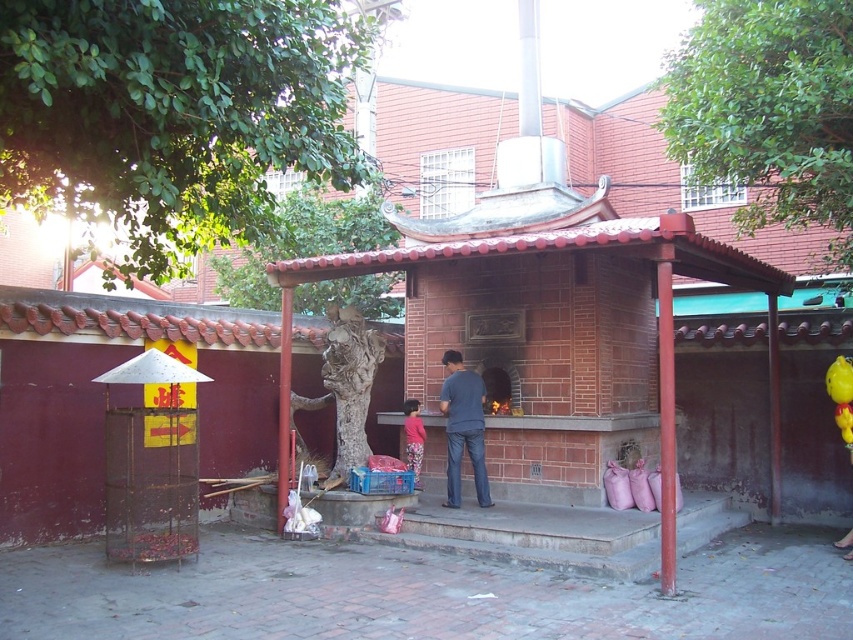
You are a visitor at the shrine and want to take a photo of the red brick shrine at center and dark blue jeans at center together in the frame. Which object should you focus on first to ensure both are in the frame?

You should focus on the red brick shrine at center first because it is larger than the dark blue jeans at center, so it will take up more space in the photo.

Looking at this image, you are standing at the entrance of a garden and see the red brick shrine at center. If you want to take a photo of it from where you are standing, will you be able to capture the entire shrine in one frame without moving closer or farther away?

The red brick shrine at center is 30.62 feet away from the camera. Whether you can capture the entire shrine in one frame depends on your camera lens. A standard lens with a 50mm focal length might require adjusting your position or using a wider angle lens to include the entire structure in the frame.

You are standing in front of the shrine and want to place a decorative item between the red brick shrine at center and the pink floral pants at center. Based on their positions, which object should you place the item closer to in order to ensure it is equidistant from both?

The red brick shrine at center is closer to the viewer than the pink floral pants at center, so to place the item equidistant from both, it should be closer to the pink floral pants at center.